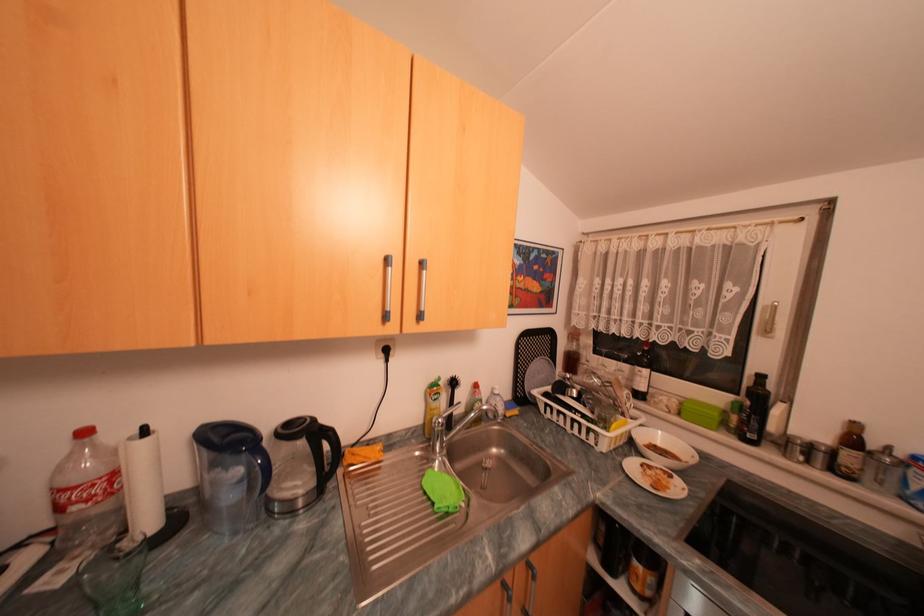
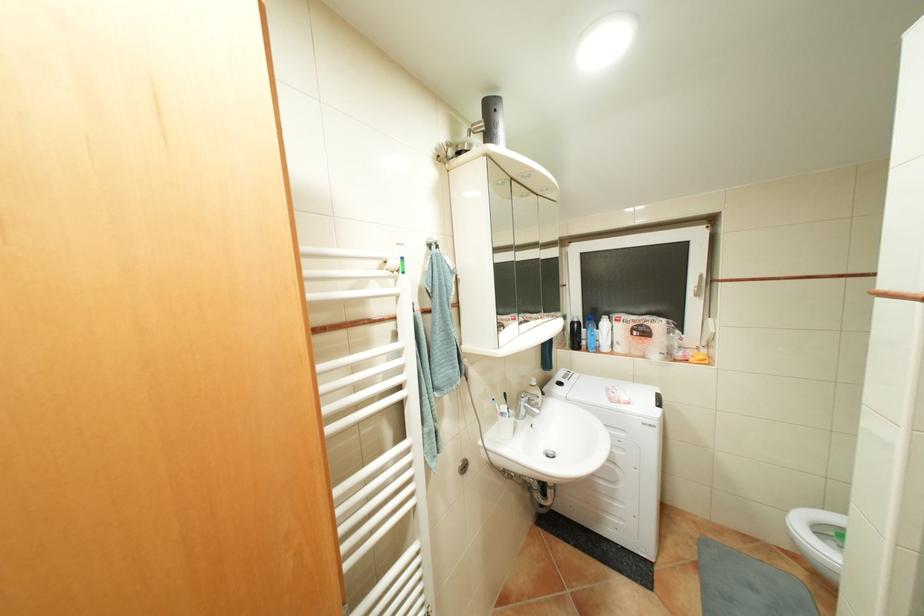
In a continuous first-person perspective shot, in which direction is the camera moving?

The cameraman moved toward left, forward.